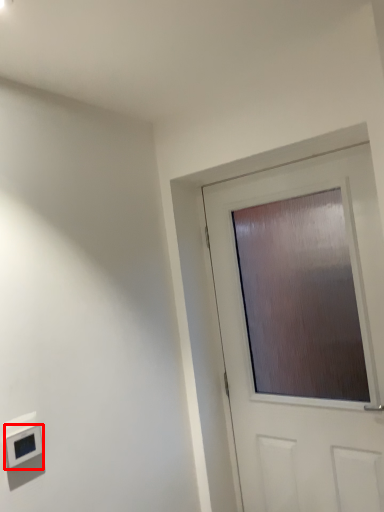
Question: In this image, where is light switch (annotated by the red box) located relative to door?

Choices:
 (A) left
 (B) right

Answer: (A)